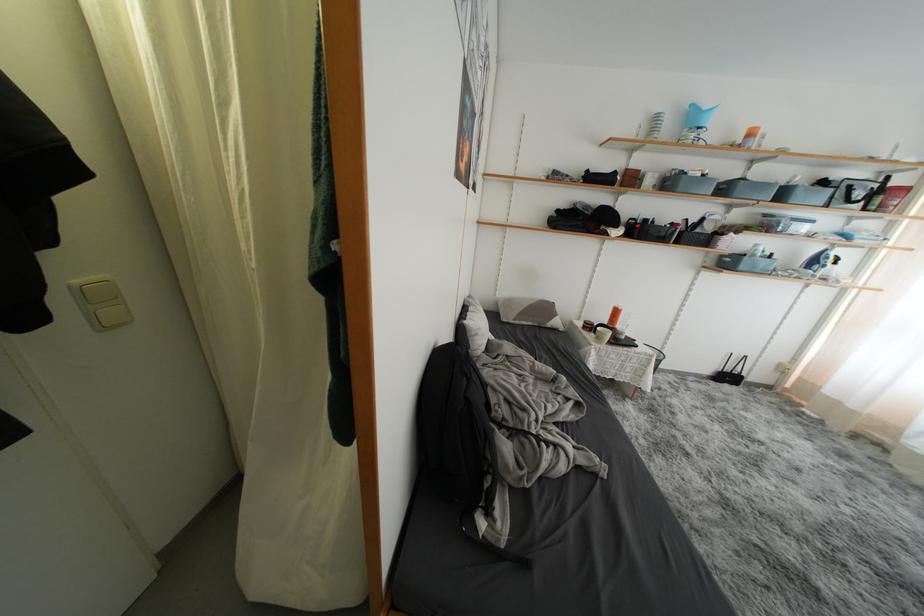
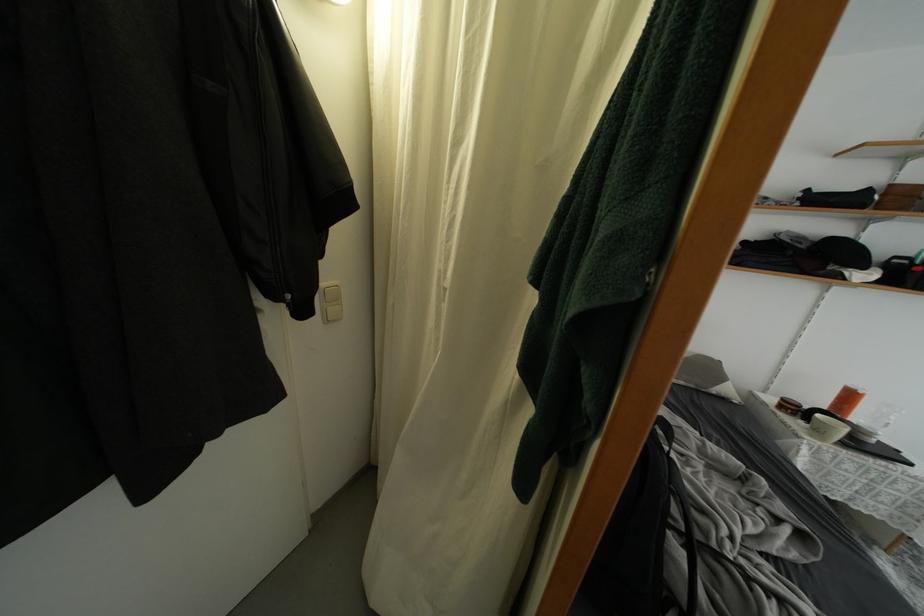
Find the pixel in the second image that matches point 622,315 in the first image.

(856, 400)